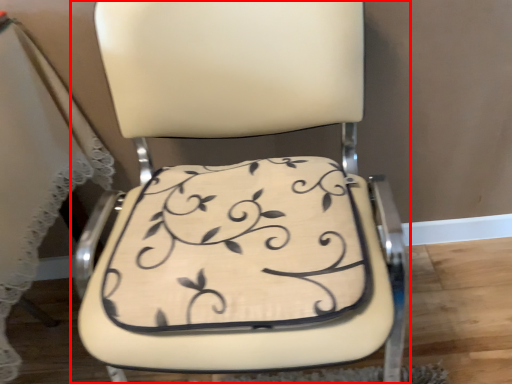
Question: Where is chair (annotated by the red box) located in relation to pillow in the image?

Choices:
 (A) right
 (B) left

Answer: (A)